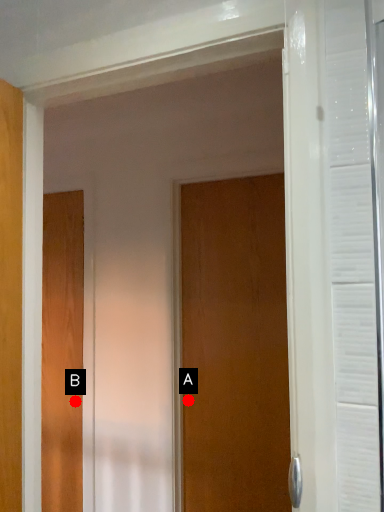
Question: Two points are circled on the image, labeled by A and B beside each circle. Which point is closer to the camera?

Choices:
 (A) A is closer
 (B) B is closer

Answer: (A)